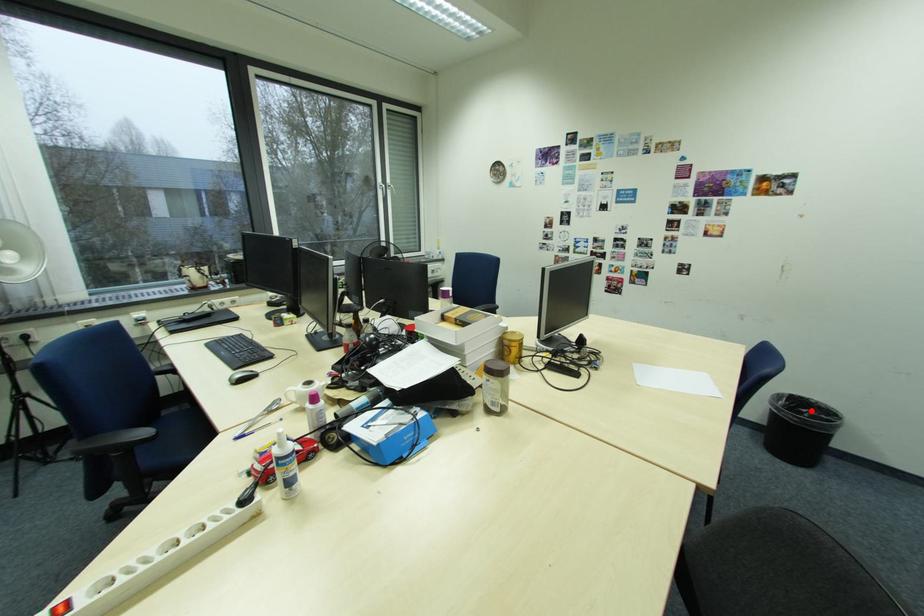
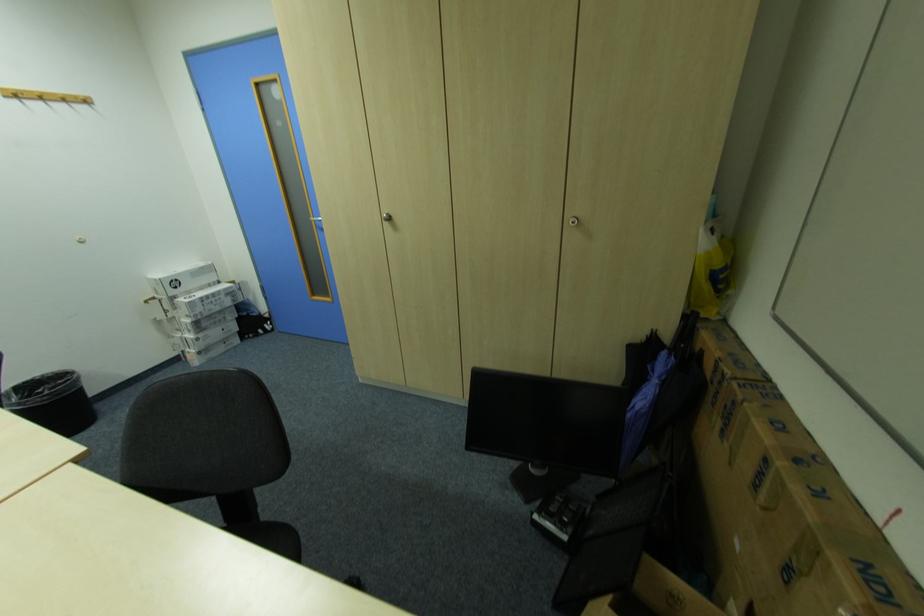
Where in the second image is the point corresponding to the highlighted location from the first image?

(49, 391)